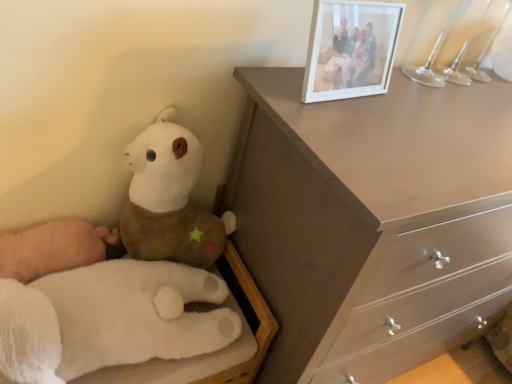
The image size is (512, 384). What do you see at coordinates (350, 49) in the screenshot?
I see `white plastic picture frame at upper right` at bounding box center [350, 49].

This screenshot has width=512, height=384. Describe the element at coordinates (109, 319) in the screenshot. I see `white plush hand at lower left, the second toy from the top` at that location.

Measure the distance between matte brown dresser at upper right and camera.

The depth of matte brown dresser at upper right is 24.79 inches.

The image size is (512, 384). Describe the element at coordinates (169, 199) in the screenshot. I see `white plush toy at left, which ranks as the second toy in bottom-to-top order` at that location.

This screenshot has width=512, height=384. In order to click on white plastic picture frame at upper right in this screenshot , I will do `click(350, 49)`.

In the image, is matte brown dresser at upper right on the left side or the right side of white plush toy at left, acting as the first toy starting from the top?

Clearly, matte brown dresser at upper right is on the right of white plush toy at left, acting as the first toy starting from the top, in the image.

In the scene shown: Is matte brown dresser at upper right turned away from white plush toy at left, acting as the first toy starting from the top?

No, white plush toy at left, acting as the first toy starting from the top, is not at the back of matte brown dresser at upper right.

Locate an element on the screen. the 2nd toy positioned above the matte brown dresser at upper right (from a real-world perspective) is located at coordinates (169, 199).

Is white plush hand at lower left, the second toy from the top, facing away from white plush toy at left, which ranks as the second toy in bottom-to-top order?

Correct, white plush hand at lower left, the second toy from the top, is looking away from white plush toy at left, which ranks as the second toy in bottom-to-top order.

From a real-world perspective, is white plush hand at lower left, the second toy from the top, over white plush toy at left, acting as the first toy starting from the top?

No.

Considering the sizes of white plush hand at lower left, which is the first toy in bottom-to-top order, and white plush toy at left, acting as the first toy starting from the top, in the image, is white plush hand at lower left, which is the first toy in bottom-to-top order, wider or thinner than white plush toy at left, acting as the first toy starting from the top,?

In the image, white plush hand at lower left, which is the first toy in bottom-to-top order, appears to be wider than white plush toy at left, acting as the first toy starting from the top.

From the image's perspective, would you say white plush hand at lower left, the second toy from the top, is positioned over matte brown dresser at upper right?

Incorrect, from the image's perspective, white plush hand at lower left, the second toy from the top, is lower than matte brown dresser at upper right.

Is white plush hand at lower left, which is the first toy in bottom-to-top order, further to camera compared to matte brown dresser at upper right?

Yes, white plush hand at lower left, which is the first toy in bottom-to-top order, is further from the viewer.

Looking at the image, does white plush hand at lower left, which is the first toy in bottom-to-top order, seem bigger or smaller compared to matte brown dresser at upper right?

Considering their sizes, white plush hand at lower left, which is the first toy in bottom-to-top order, takes up less space than matte brown dresser at upper right.

How far apart are white plush hand at lower left, which is the first toy in bottom-to-top order, and white plastic picture frame at upper right?

They are 23.17 inches apart.

Which is behind, point (187, 357) or point (387, 24)?

Positioned behind is point (187, 357).

Would you say white plastic picture frame at upper right is part of white plush hand at lower left, which is the first toy in bottom-to-top order,'s contents?

That's incorrect, white plastic picture frame at upper right is not inside white plush hand at lower left, which is the first toy in bottom-to-top order.

Is white plush toy at left, acting as the first toy starting from the top, looking in the opposite direction of white plastic picture frame at upper right?

No, white plastic picture frame at upper right is not at the back of white plush toy at left, acting as the first toy starting from the top.

Considering the positions of objects white plush toy at left, which ranks as the second toy in bottom-to-top order, and white plastic picture frame at upper right in the image provided, who is in front, white plush toy at left, which ranks as the second toy in bottom-to-top order, or white plastic picture frame at upper right?

Positioned in front is white plastic picture frame at upper right.

In the scene shown: Who is taller, white plush toy at left, acting as the first toy starting from the top, or white plastic picture frame at upper right?

white plush toy at left, acting as the first toy starting from the top, is taller.

Is white plastic picture frame at upper right positioned with its back to white plush hand at lower left, which is the first toy in bottom-to-top order?

No, white plastic picture frame at upper right is not facing the opposite direction of white plush hand at lower left, which is the first toy in bottom-to-top order.

From the picture: From a real-world perspective, is white plastic picture frame at upper right over white plush hand at lower left, the second toy from the top?

Yes.

How distant is white plastic picture frame at upper right from white plush hand at lower left, which is the first toy in bottom-to-top order?

white plastic picture frame at upper right is 23.17 inches from white plush hand at lower left, which is the first toy in bottom-to-top order.

This screenshot has width=512, height=384. What are the coordinates of `picture frame that appears behind the white plush hand at lower left, which is the first toy in bottom-to-top order` in the screenshot? It's located at (350, 49).

Which object is wider, white plastic picture frame at upper right or white plush toy at left, which ranks as the second toy in bottom-to-top order?

With larger width is white plush toy at left, which ranks as the second toy in bottom-to-top order.

Is white plush toy at left, which ranks as the second toy in bottom-to-top order, completely or partially inside white plastic picture frame at upper right?

No, white plush toy at left, which ranks as the second toy in bottom-to-top order, is not surrounded by white plastic picture frame at upper right.

From a real-world perspective, who is located higher, white plastic picture frame at upper right or white plush toy at left, which ranks as the second toy in bottom-to-top order?

white plastic picture frame at upper right, from a real-world perspective.

Considering the positions of points (373, 62) and (160, 159), is point (373, 62) farther from camera compared to point (160, 159)?

Yes, it is behind point (160, 159).

You are a GUI agent. You are given a task and a screenshot of the screen. Output one action in this format:
    pyautogui.click(x=<x>, y=<y>)
    Task: Click on the chest of drawers below the white plush toy at left, acting as the first toy starting from the top (from the image's perspective)
    This screenshot has height=384, width=512.
    Given the screenshot: What is the action you would take?
    pyautogui.click(x=372, y=221)

Locate an element on the screen. toy behind the white plush hand at lower left, which is the first toy in bottom-to-top order is located at coordinates (169, 199).

Looking at the image, which one is located further to white plastic picture frame at upper right, white plush toy at left, which ranks as the second toy in bottom-to-top order, or matte brown dresser at upper right?

white plush toy at left, which ranks as the second toy in bottom-to-top order.

From the image, which object appears to be farther from white plush hand at lower left, the second toy from the top, white plastic picture frame at upper right or matte brown dresser at upper right?

white plastic picture frame at upper right is further to white plush hand at lower left, the second toy from the top.

When comparing their distances from matte brown dresser at upper right, does white plush toy at left, which ranks as the second toy in bottom-to-top order, or white plush hand at lower left, which is the first toy in bottom-to-top order, seem closer?

white plush toy at left, which ranks as the second toy in bottom-to-top order, is closer to matte brown dresser at upper right.

Based on their spatial positions, is matte brown dresser at upper right or white plush hand at lower left, the second toy from the top, further from white plastic picture frame at upper right?

Based on the image, white plush hand at lower left, the second toy from the top, appears to be further to white plastic picture frame at upper right.

Considering their positions, is matte brown dresser at upper right positioned further to white plush toy at left, acting as the first toy starting from the top, than white plastic picture frame at upper right?

Based on the image, white plastic picture frame at upper right appears to be further to white plush toy at left, acting as the first toy starting from the top.

Estimate the real-world distances between objects in this image. Which object is closer to white plush hand at lower left, the second toy from the top, white plush toy at left, acting as the first toy starting from the top, or matte brown dresser at upper right?

white plush toy at left, acting as the first toy starting from the top, is closer to white plush hand at lower left, the second toy from the top.

Which object lies further to the anchor point matte brown dresser at upper right, white plastic picture frame at upper right or white plush toy at left, which ranks as the second toy in bottom-to-top order?

white plush toy at left, which ranks as the second toy in bottom-to-top order, lies further to matte brown dresser at upper right than the other object.

Based on their spatial positions, is matte brown dresser at upper right or white plastic picture frame at upper right closer to white plush hand at lower left, the second toy from the top?

matte brown dresser at upper right lies closer to white plush hand at lower left, the second toy from the top, than the other object.

Where is `toy between white plastic picture frame at upper right and white plush hand at lower left, which is the first toy in bottom-to-top order, in the vertical direction`? The width and height of the screenshot is (512, 384). toy between white plastic picture frame at upper right and white plush hand at lower left, which is the first toy in bottom-to-top order, in the vertical direction is located at coordinates tap(169, 199).

Where is `picture frame between white plush toy at left, acting as the first toy starting from the top, and matte brown dresser at upper right`? picture frame between white plush toy at left, acting as the first toy starting from the top, and matte brown dresser at upper right is located at coordinates (350, 49).

Image resolution: width=512 pixels, height=384 pixels. Find the location of `picture frame between white plush hand at lower left, which is the first toy in bottom-to-top order, and matte brown dresser at upper right`. picture frame between white plush hand at lower left, which is the first toy in bottom-to-top order, and matte brown dresser at upper right is located at coordinates (350, 49).

At what (x,y) coordinates should I click in order to perform the action: click on toy situated between white plush hand at lower left, which is the first toy in bottom-to-top order, and matte brown dresser at upper right from left to right. Please return your answer as a coordinate pair (x, y). Image resolution: width=512 pixels, height=384 pixels. Looking at the image, I should click on (169, 199).